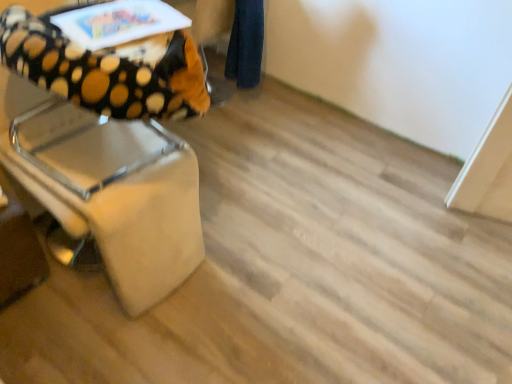
Find the location of `free space in front of beige leather chair at left`. free space in front of beige leather chair at left is located at coordinates (81, 333).